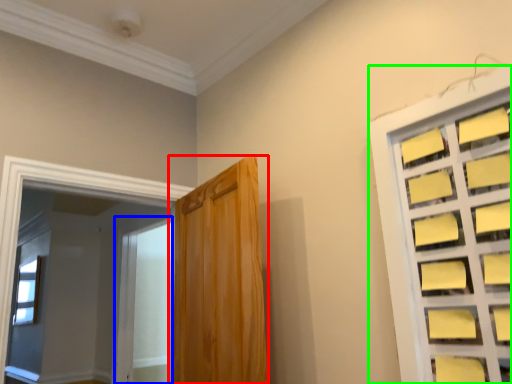
Question: Which is nearer to the door (highlighted by a red box)? screen door (highlighted by a blue box) or window (highlighted by a green box).

Choices:
 (A) screen door
 (B) window

Answer: (B)